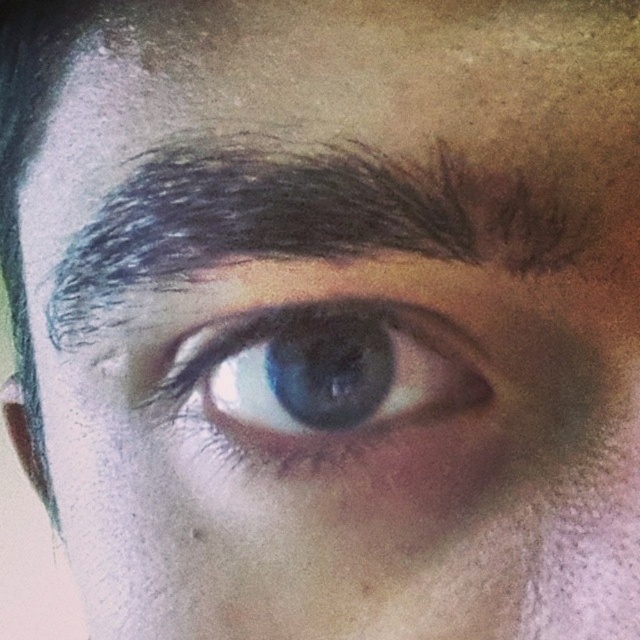
You are a makeup artist preparing to apply eyeliner to the blue glossy eye at center. You notice the dark brown hair at upper center. Based on their positions, will the hair cast a shadow over the eye when applying eyeliner?

The dark brown hair at upper center is taller than the blue glossy eye at center, so it may cast a shadow over the eye when applying eyeliner.